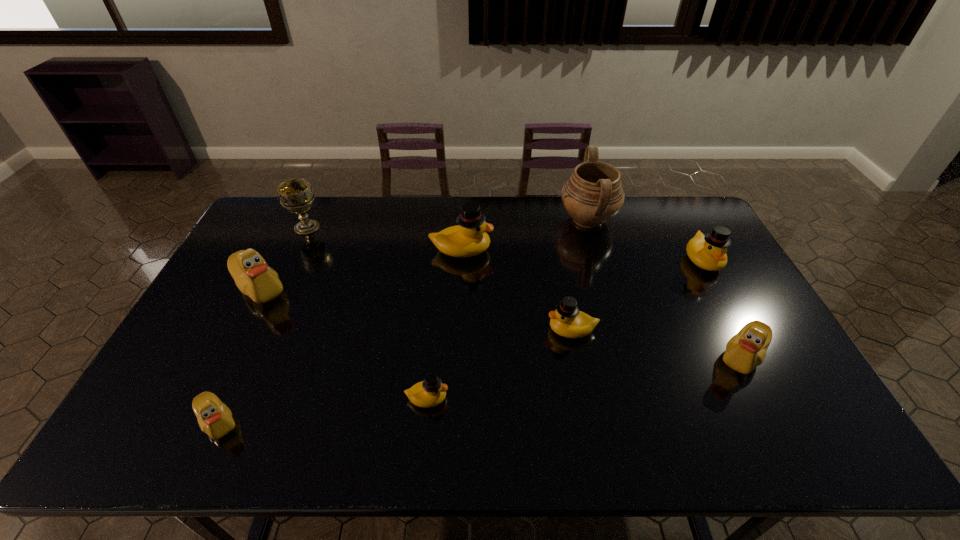
Locate an element on the screen. empty space that is in between the white chalice and the second biggest yellow duck is located at coordinates coord(505,244).

The width and height of the screenshot is (960, 540). Identify the location of blank region between the second smallest yellow duck and the smallest beige duck. (395, 376).

Locate an element on the screen. This screenshot has width=960, height=540. unoccupied area between the nearest beige duck and the biggest yellow duck is located at coordinates (340, 336).

Identify the location of empty location between the third smallest yellow duck and the farthest beige duck. (481, 274).

The width and height of the screenshot is (960, 540). What are the coordinates of `free point between the urn and the second biggest yellow duck` in the screenshot? It's located at (645, 240).

You are a GUI agent. You are given a task and a screenshot of the screen. Output one action in this format:
    pyautogui.click(x=<x>, y=<y>)
    Task: Click on the object that is the third closest to the smallest beige duck
    This screenshot has width=960, height=540.
    Given the screenshot: What is the action you would take?
    pyautogui.click(x=469, y=238)

Identify which object is the seventh closest to the rightmost beige duck. Please provide its 2D coordinates. Your answer should be formatted as a tuple, i.e. [(x, y)], where the tuple contains the x and y coordinates of a point satisfying the conditions above.

[(253, 277)]

Identify the location of the sixth closest duck to the chalice. (708, 252).

Identify which duck is the closest to the fifth duck from left to right. Please provide its 2D coordinates. Your answer should be formatted as a tuple, i.e. [(x, y)], where the tuple contains the x and y coordinates of a point satisfying the conditions above.

[(469, 238)]

Point out which yellow duck is positioned as the nearest to the nearest yellow duck. Please provide its 2D coordinates. Your answer should be formatted as a tuple, i.e. [(x, y)], where the tuple contains the x and y coordinates of a point satisfying the conditions above.

[(567, 321)]